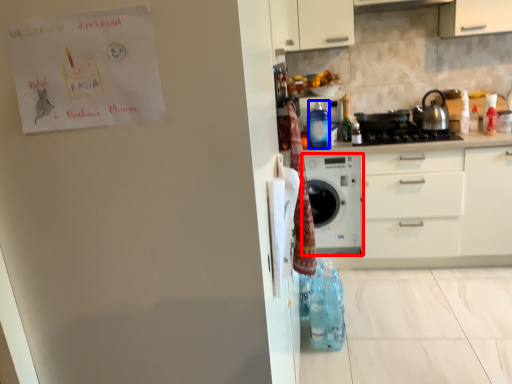
Question: Which object appears closest to the camera in this image, home appliance (highlighted by a red box) or bottle (highlighted by a blue box)?

Choices:
 (A) home appliance
 (B) bottle

Answer: (B)